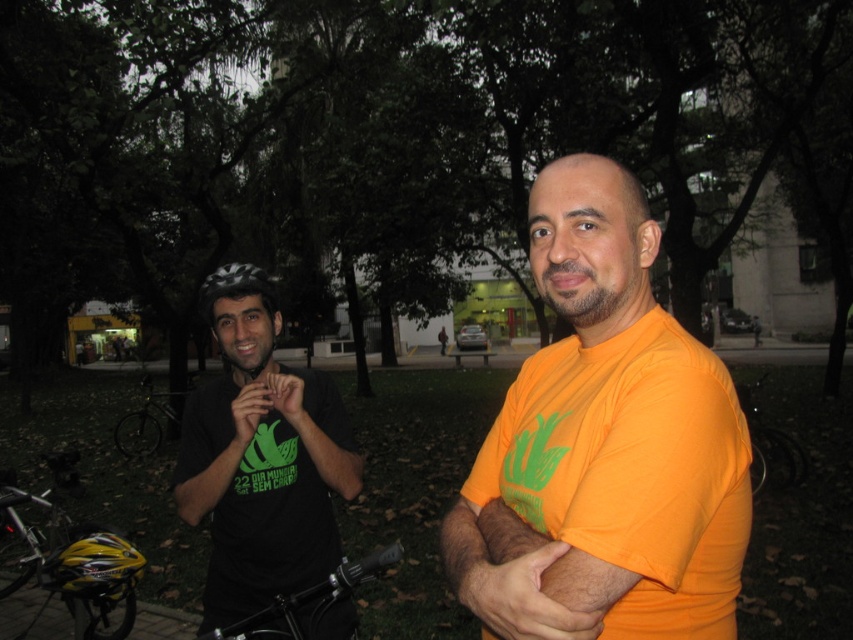
Question: Which object appears farthest from the camera in this image?

Choices:
 (A) black matte bicycle handlebars at lower center
 (B) white and black striped bicycle helmet at left

Answer: (B)

Question: Which of these objects is positioned closest to the black matte helmet at left?

Choices:
 (A) black matte shirt at center
 (B) yellow matte helmet at lower left

Answer: (A)

Question: Is yellow matte helmet at lower left further to the viewer compared to black matte bicycle at left?

Choices:
 (A) yes
 (B) no

Answer: (B)

Question: Can you confirm if yellow matte helmet at lower left is positioned above black matte bicycle handlebars at lower center?

Choices:
 (A) no
 (B) yes

Answer: (A)

Question: Where is green matte shirt at left located in relation to black matte bicycle at center in the image?

Choices:
 (A) above
 (B) below

Answer: (A)

Question: Which point is closer to the camera taking this photo?

Choices:
 (A) (213, 604)
 (B) (543, 406)
 (C) (258, 282)
 (D) (795, 452)

Answer: (B)